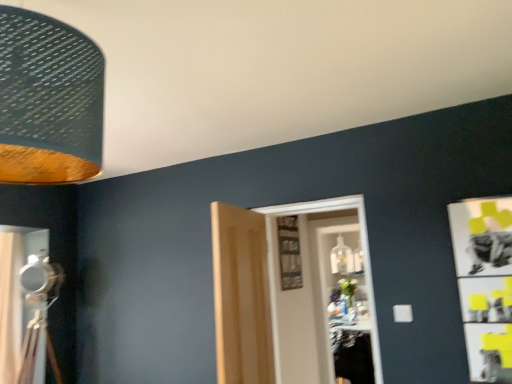
Question: Visually, is metallic silver tripod at left positioned to the left or to the right of matte silver curtain at left?

Choices:
 (A) left
 (B) right

Answer: (B)

Question: From the image's perspective, relative to matte silver curtain at left, is metallic silver tripod at left above or below?

Choices:
 (A) above
 (B) below

Answer: (A)

Question: Estimate the real-world distances between objects in this image. Which object is farther from the light wood paneling at center, the 1th door positioned from the left?

Choices:
 (A) metallic silver tripod at left
 (B) textured fabric lampshade at upper left
 (C) white wooden door at center, which is the 1th door in right-to-left order
 (D) matte silver curtain at left
 (E) transparent glass door at center

Answer: (D)

Question: Which is farther from the metallic silver tripod at left?

Choices:
 (A) textured fabric lampshade at upper left
 (B) matte silver curtain at left
 (C) light wood paneling at center, the 1th door positioned from the left
 (D) white wooden door at center, arranged as the 2th door when viewed from the left
 (E) transparent glass door at center

Answer: (E)